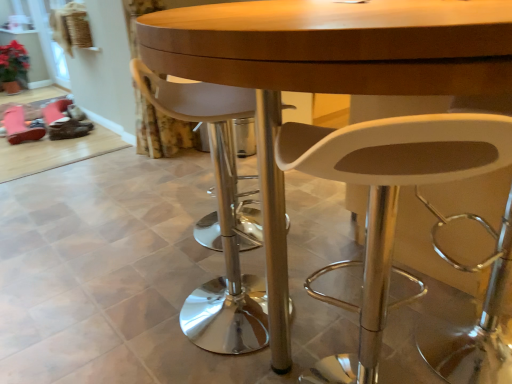
At what (x,y) coordinates should I click in order to perform the action: click on vacant area that lies to the right of white plastic stool at center, the second chair from the right. Please return your answer as a coordinate pair (x, y). This screenshot has width=512, height=384. Looking at the image, I should click on (330, 305).